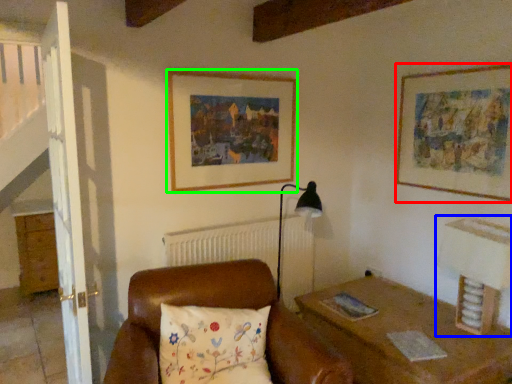
Question: Which object is the closest to the picture frame (highlighted by a red box)? Choose among these: table lamp (highlighted by a blue box) or picture frame (highlighted by a green box).

Choices:
 (A) table lamp
 (B) picture frame

Answer: (A)